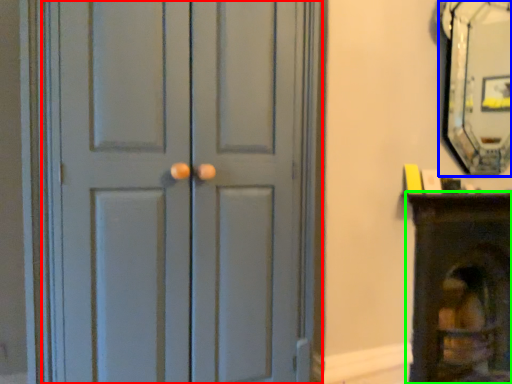
Question: Estimate the real-world distances between objects in this image. Which object is farther from door (highlighted by a red box), fireplace (highlighted by a blue box) or furniture (highlighted by a green box)?

Choices:
 (A) fireplace
 (B) furniture

Answer: (A)